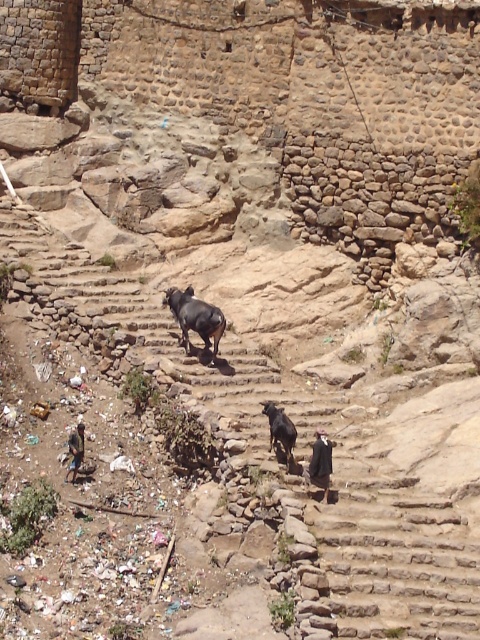
Which is behind, point (219, 317) or point (279, 436)?

The point (219, 317) is behind.

Between dark brown glossy cow at center and black glossy cow at center, which one is positioned lower?

black glossy cow at center is below.

Who is more distant from viewer, (x=214, y=356) or (x=287, y=456)?

The point (x=214, y=356) is more distant.

At what (x,y) coordinates should I click in order to perform the action: click on dark brown glossy cow at center. Please return your answer as a coordinate pair (x, y). Image resolution: width=480 pixels, height=640 pixels. Looking at the image, I should click on (195, 317).